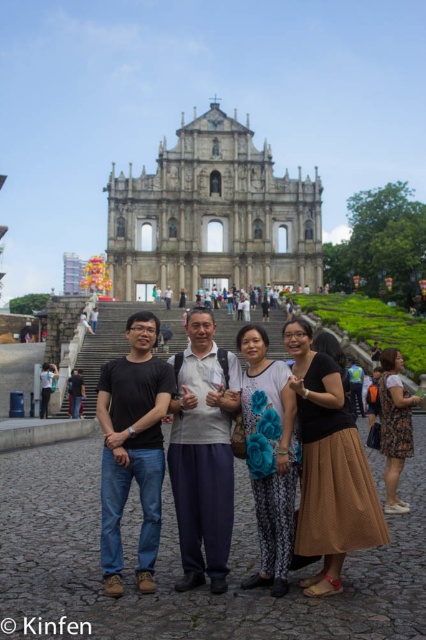
You are a photographer trying to capture a closeup shot of the brown textured skirt at center and the matte blue fabric purse at center. Since your camera can only focus on one object at a time, which object should you choose to ensure it appears sharp and in focus?

The brown textured skirt at center has a larger size compared to the matte blue fabric purse at center, so it is better to focus on the brown textured skirt at center to ensure it appears sharp and in focus.